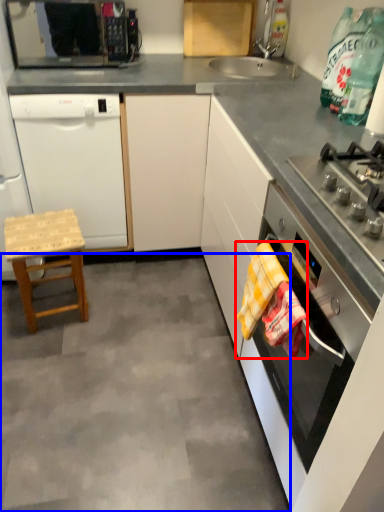
Question: Which object is closer to the camera taking this photo, blanket (highlighted by a red box) or concrete (highlighted by a blue box)?

Choices:
 (A) blanket
 (B) concrete

Answer: (A)